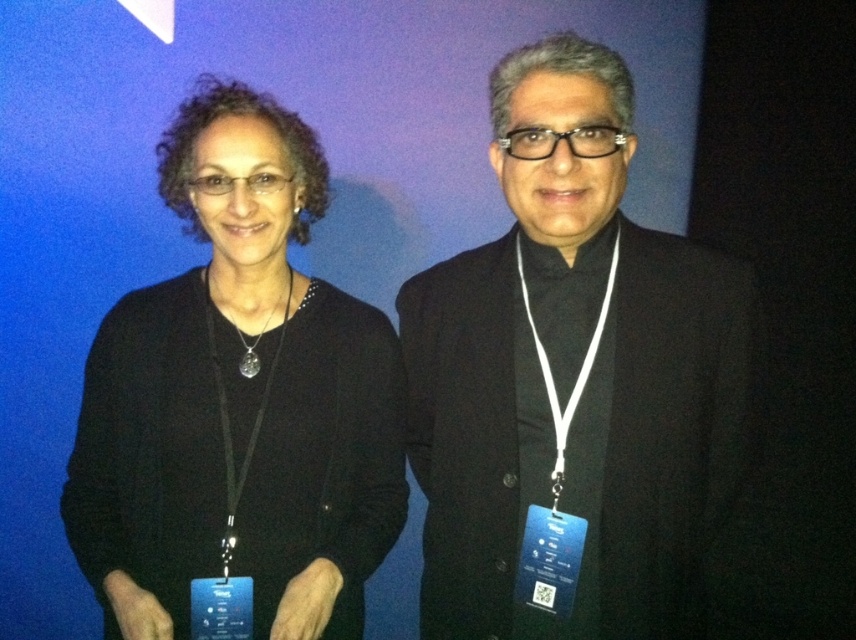
You are a photographer adjusting the focus on your camera. You notice two points in the image at coordinates point (500, 531) and point (337, 451). Which of these points should you focus on first if you want to ensure the person closer to the camera is in sharp focus?

Point (500, 531) is closer to the camera than point (337, 451), so you should focus on point (500, 531) first to ensure the person closer to the camera is in sharp focus.